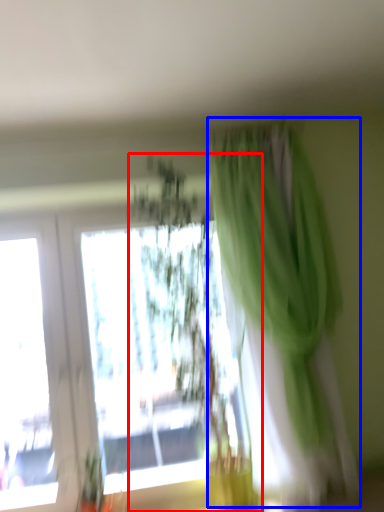
Question: Which point is further to the camera, houseplant (highlighted by a red box) or curtain (highlighted by a blue box)?

Choices:
 (A) houseplant
 (B) curtain

Answer: (A)